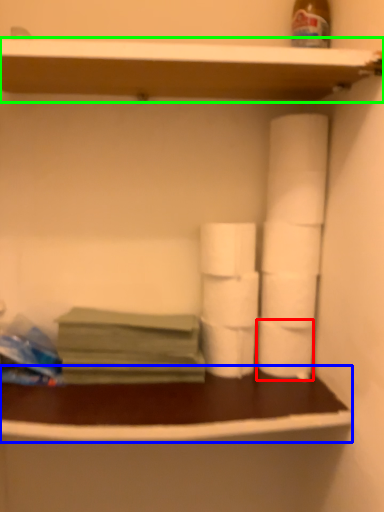
Question: Which is nearer to the toilet paper (highlighted by a red box)? counter (highlighted by a blue box) or shelf (highlighted by a green box).

Choices:
 (A) counter
 (B) shelf

Answer: (A)